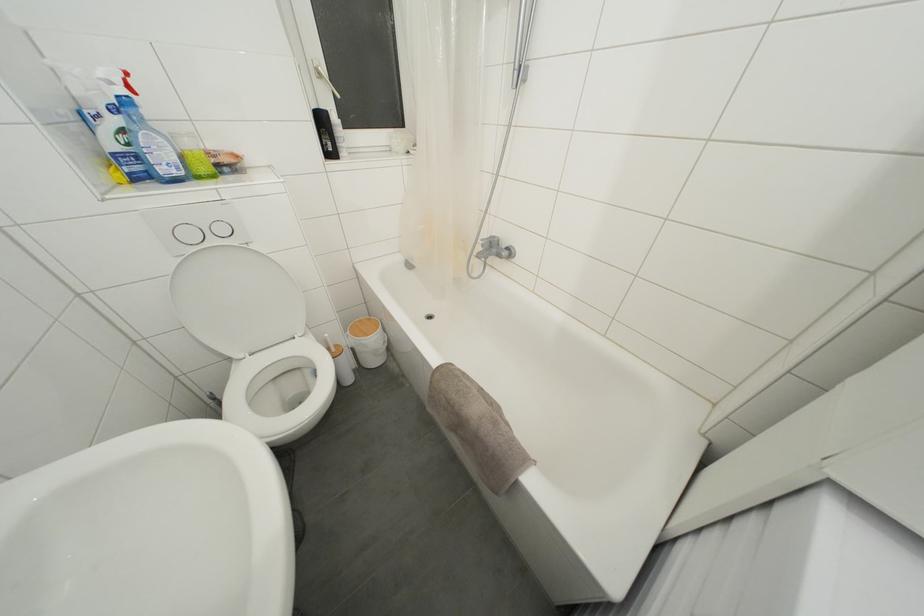
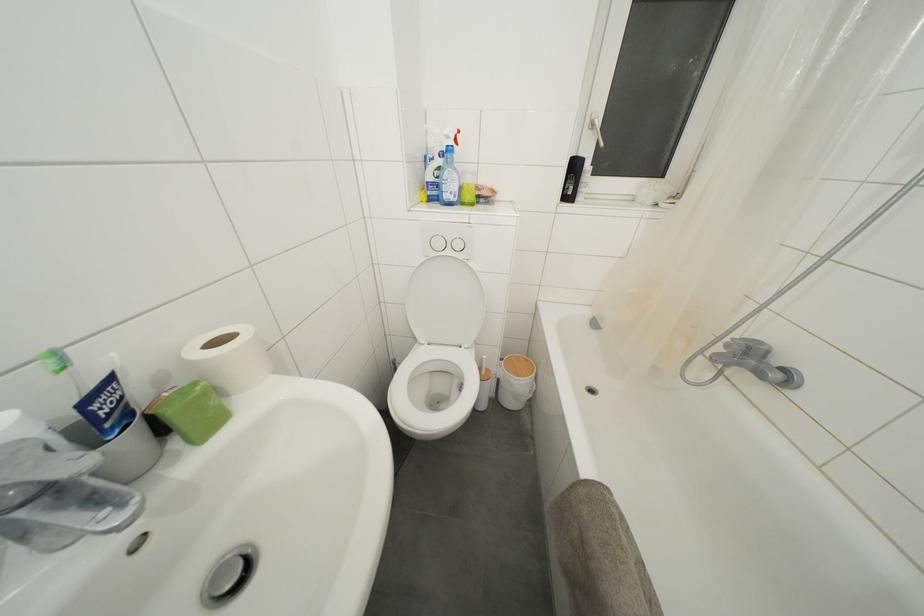
Find the pixel in the second image that matches [363,326] in the first image.

(521, 362)